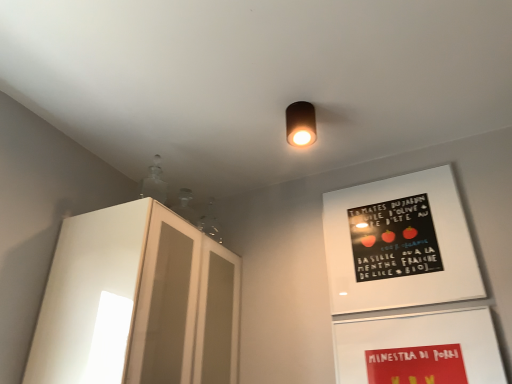
Question: From the image's perspective, is matte white bulletin board at lower right, the second bulletin board viewed from the top, under white glossy cabinet at left?

Choices:
 (A) yes
 (B) no

Answer: (A)

Question: Does matte white bulletin board at lower right, the second bulletin board viewed from the top, appear on the left side of white glossy cabinet at left?

Choices:
 (A) yes
 (B) no

Answer: (B)

Question: Can you confirm if matte white bulletin board at lower right, which appears as the 1th bulletin board when ordered from the bottom, is thinner than white glossy cabinet at left?

Choices:
 (A) yes
 (B) no

Answer: (A)

Question: Is matte white bulletin board at lower right, which appears as the 1th bulletin board when ordered from the bottom, smaller than white glossy cabinet at left?

Choices:
 (A) no
 (B) yes

Answer: (B)

Question: From a real-world perspective, is matte white bulletin board at lower right, the second bulletin board viewed from the top, beneath white glossy cabinet at left?

Choices:
 (A) no
 (B) yes

Answer: (B)

Question: Is point [x=369, y=253] closer or farther from the camera than point [x=208, y=294]?

Choices:
 (A) closer
 (B) farther

Answer: (B)

Question: Considering the relative positions of matte black poster at upper right, which ranks as the first bulletin board in top-to-bottom order, and white glossy cabinet at left in the image provided, is matte black poster at upper right, which ranks as the first bulletin board in top-to-bottom order, to the left or to the right of white glossy cabinet at left?

Choices:
 (A) left
 (B) right

Answer: (B)

Question: Is matte black poster at upper right, which ranks as the first bulletin board in top-to-bottom order, wider or thinner than white glossy cabinet at left?

Choices:
 (A) wide
 (B) thin

Answer: (B)

Question: In the image, is matte black poster at upper right, which ranks as the first bulletin board in top-to-bottom order, positioned in front of or behind white glossy cabinet at left?

Choices:
 (A) behind
 (B) front

Answer: (A)

Question: Is white glossy cabinet at left bigger or smaller than matte black cylinder at center?

Choices:
 (A) big
 (B) small

Answer: (A)

Question: Is white glossy cabinet at left in front of or behind matte black cylinder at center in the image?

Choices:
 (A) behind
 (B) front

Answer: (B)

Question: From the image's perspective, is white glossy cabinet at left above or below matte black cylinder at center?

Choices:
 (A) above
 (B) below

Answer: (B)

Question: Is white glossy cabinet at left to the left or to the right of matte black cylinder at center in the image?

Choices:
 (A) left
 (B) right

Answer: (A)

Question: Is point (352, 332) closer or farther from the camera than point (121, 205)?

Choices:
 (A) closer
 (B) farther

Answer: (B)

Question: In terms of height, does matte white bulletin board at lower right, which appears as the 1th bulletin board when ordered from the bottom, look taller or shorter compared to white glossy cabinet at left?

Choices:
 (A) short
 (B) tall

Answer: (A)